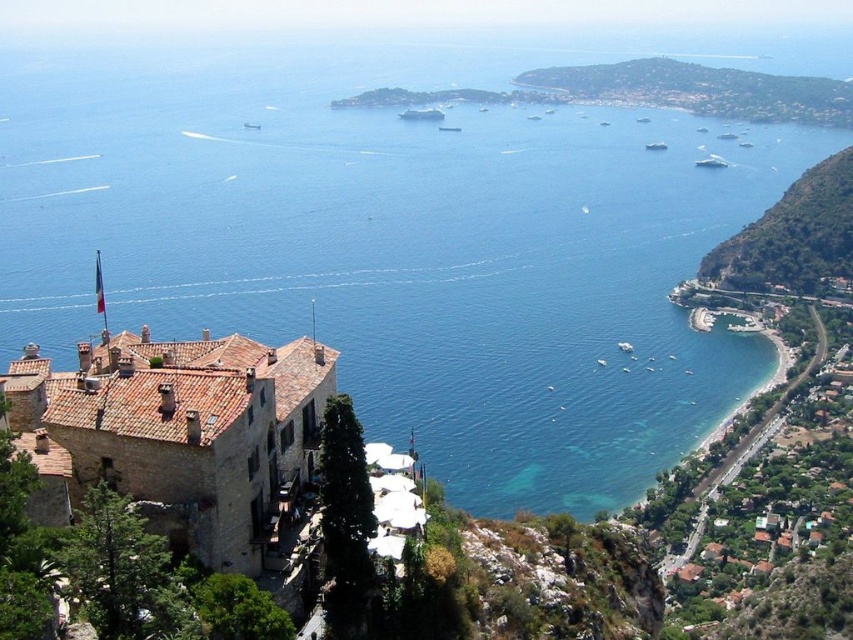
Question: Does white glossy ship at center have a greater width compared to white glossy boat at center-right?

Choices:
 (A) no
 (B) yes

Answer: (B)

Question: Which point is farther to the camera?

Choices:
 (A) green grassy hillside at upper right
 (B) white glossy boat at center-right
 (C) white glossy ship at center
 (D) metallic silver boat at center

Answer: (A)

Question: Does metallic silver boat at center appear over white glossy boat at center-right?

Choices:
 (A) yes
 (B) no

Answer: (B)

Question: Which object is the farthest from the white glossy ship at center?

Choices:
 (A) white glossy boat at center-right
 (B) green leafy hillside at right
 (C) green grassy hillside at upper right
 (D) metallic silver boat at center

Answer: (B)

Question: Which of these objects is positioned closest to the green leafy hillside at right?

Choices:
 (A) white glossy ship at center
 (B) white glossy boat at center-right
 (C) metallic silver boat at center
 (D) green grassy hillside at upper right

Answer: (C)

Question: Can you confirm if green leafy hillside at right is positioned below white glossy ship at center?

Choices:
 (A) yes
 (B) no

Answer: (A)